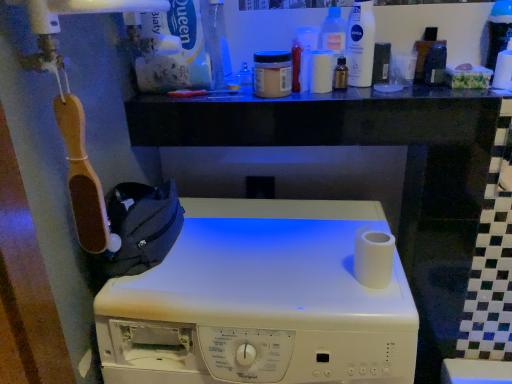
Question: Does translucent amber bottle at upper center, the second toiletry in the right-to-left sequence, appear on the left side of transparent glass bottle at upper center?

Choices:
 (A) yes
 (B) no

Answer: (B)

Question: From the image's perspective, does translucent amber bottle at upper center, the second toiletry in the right-to-left sequence, appear higher than transparent glass bottle at upper center?

Choices:
 (A) no
 (B) yes

Answer: (A)

Question: Is translucent amber bottle at upper center, the 5th toiletry from the left, facing away from transparent glass bottle at upper center?

Choices:
 (A) no
 (B) yes

Answer: (A)

Question: Is transparent glass bottle at upper center inside translucent amber bottle at upper center, the 5th toiletry from the left?

Choices:
 (A) no
 (B) yes

Answer: (A)

Question: Is translucent amber bottle at upper center, the second toiletry in the right-to-left sequence, closer to camera compared to transparent glass bottle at upper center?

Choices:
 (A) no
 (B) yes

Answer: (A)

Question: Based on their positions, is matte plastic container at center, the first toiletry from the left, located to the left or right of white matte toilet paper at upper right, positioned as the 2th toilet paper in front-to-back order?

Choices:
 (A) left
 (B) right

Answer: (A)

Question: Looking at the image, does matte plastic container at center, which is counted as the sixth toiletry, starting from the right, seem bigger or smaller compared to white matte toilet paper at upper right, positioned as the 2th toilet paper in front-to-back order?

Choices:
 (A) big
 (B) small

Answer: (B)

Question: From a real-world perspective, is matte plastic container at center, which is counted as the sixth toiletry, starting from the right, physically located above or below white matte toilet paper at upper right, the 2th toilet paper ordered from the bottom?

Choices:
 (A) above
 (B) below

Answer: (B)

Question: Considering the positions of point (249, 77) and point (494, 72), is point (249, 77) closer or farther from the camera than point (494, 72)?

Choices:
 (A) farther
 (B) closer

Answer: (A)

Question: From the image's perspective, relative to white matte bottle at upper center, the 3th toiletry in the right-to-left sequence, is matte black container at upper right, the first toiletry when ordered from right to left, above or below?

Choices:
 (A) above
 (B) below

Answer: (A)

Question: Considering the relative positions of matte black container at upper right, which is counted as the sixth toiletry, starting from the left, and white matte bottle at upper center, the 3th toiletry in the right-to-left sequence, in the image provided, is matte black container at upper right, which is counted as the sixth toiletry, starting from the left, to the left or to the right of white matte bottle at upper center, the 3th toiletry in the right-to-left sequence,?

Choices:
 (A) right
 (B) left

Answer: (A)

Question: Would you say matte black container at upper right, which is counted as the sixth toiletry, starting from the left, is inside or outside white matte bottle at upper center, the 3th toiletry in the right-to-left sequence?

Choices:
 (A) outside
 (B) inside

Answer: (A)

Question: From a real-world perspective, relative to white matte bottle at upper center, the 3th toiletry in the right-to-left sequence, is matte black container at upper right, the first toiletry when ordered from right to left, vertically above or below?

Choices:
 (A) above
 (B) below

Answer: (A)

Question: In the image, is translucent amber bottle at upper center, the 5th toiletry from the left, positioned in front of or behind transparent glass bottle at upper center?

Choices:
 (A) front
 (B) behind

Answer: (B)

Question: From their relative heights in the image, would you say translucent amber bottle at upper center, the 5th toiletry from the left, is taller or shorter than transparent glass bottle at upper center?

Choices:
 (A) tall
 (B) short

Answer: (B)